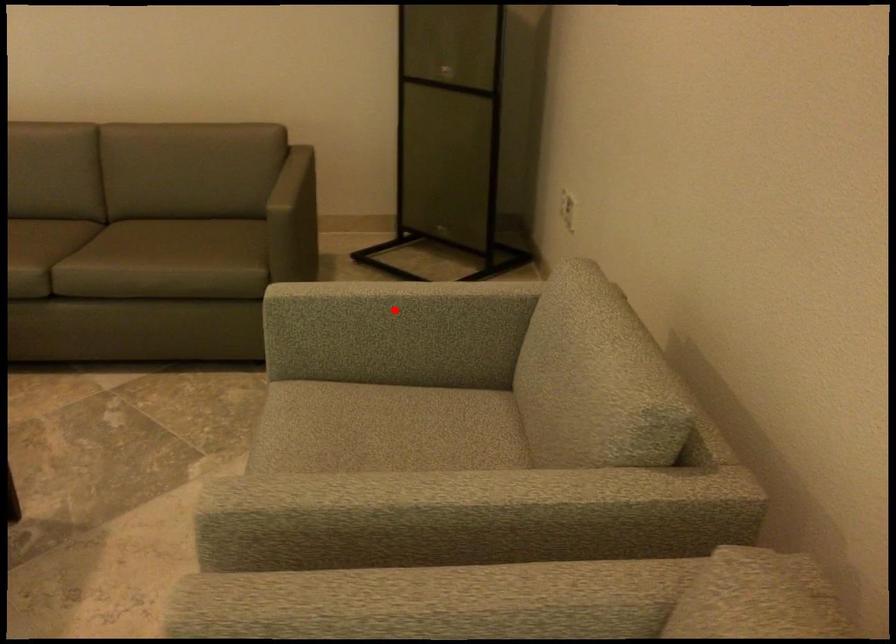
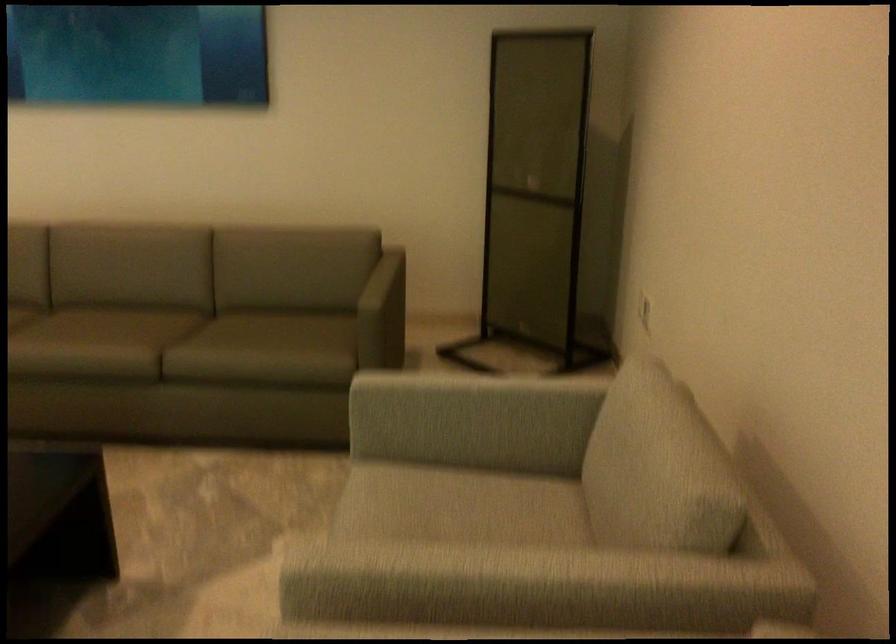
Find the pixel in the second image that matches the highlighted location in the first image.

(469, 399)